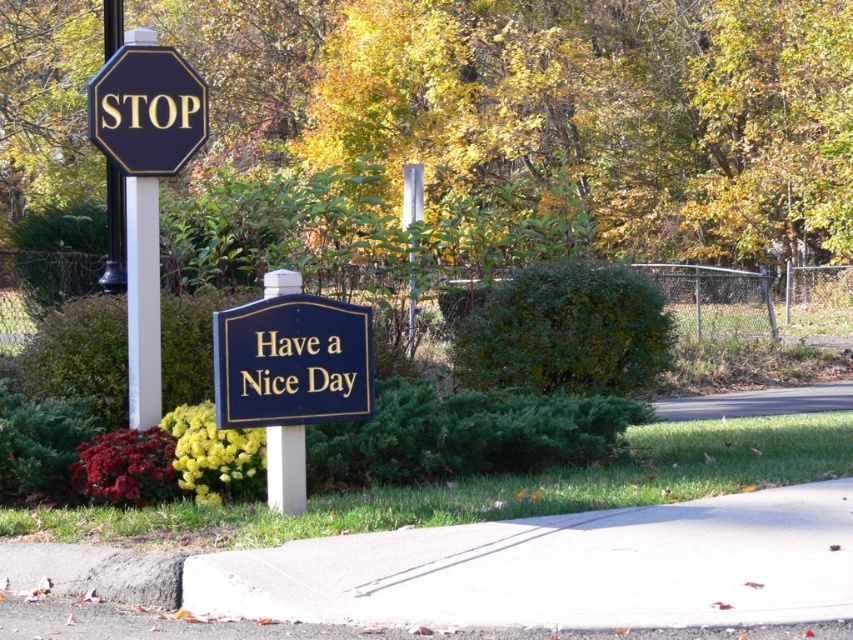
Question: Among these points, which one is farthest from the camera?

Choices:
 (A) (117, 45)
 (B) (274, 280)
 (C) (289, 400)
 (D) (144, 113)

Answer: (A)

Question: From the image, what is the correct spatial relationship of matte black octagon at upper left in relation to black metal pole at left?

Choices:
 (A) right
 (B) left

Answer: (A)

Question: Which of the following is the farthest from the observer?

Choices:
 (A) (136, 61)
 (B) (119, 218)
 (C) (263, 388)

Answer: (B)

Question: Which point is closer to the camera?

Choices:
 (A) pyautogui.click(x=281, y=461)
 (B) pyautogui.click(x=114, y=81)

Answer: (A)

Question: Does glossy blue sign at center have a greater width compared to matte black octagon at upper left?

Choices:
 (A) no
 (B) yes

Answer: (B)

Question: Is matte black octagon at upper left positioned in front of white plastic sign post at center?

Choices:
 (A) yes
 (B) no

Answer: (B)